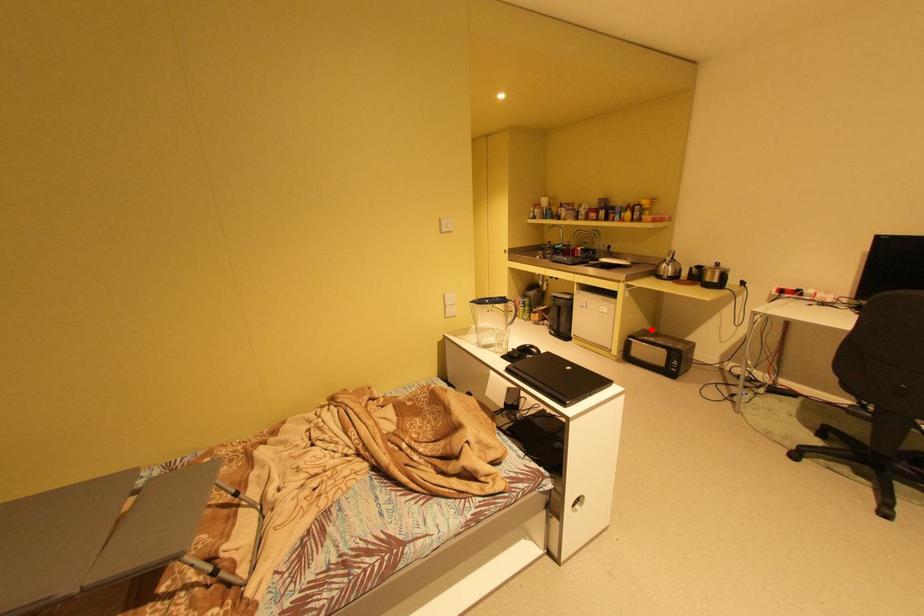
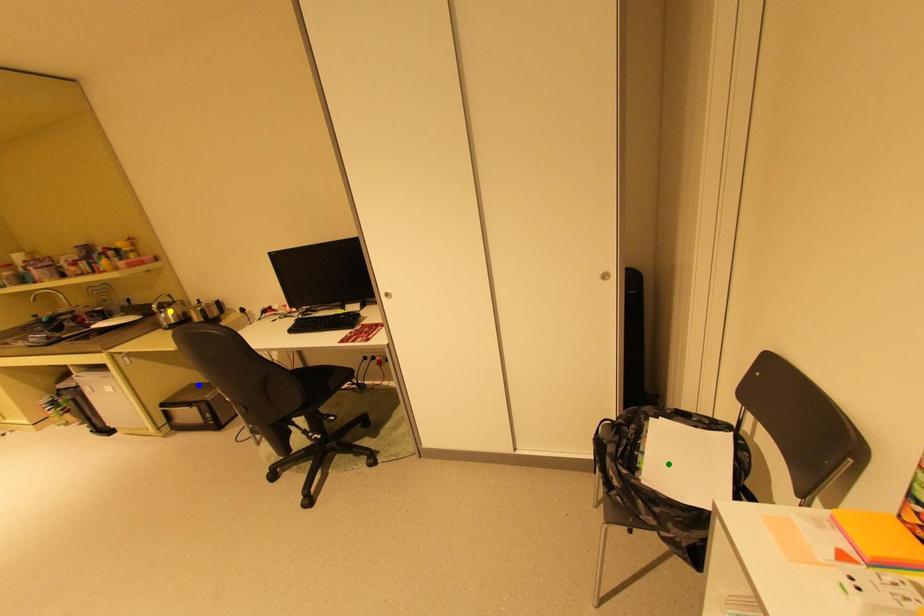
Question: I am providing you with two images of the same scene from different viewpoints. A red point is marked on the first image. You are given multiple points on the second image. Which spot in image 2 lines up with the point in image 1?

Choices:
 (A) green point
 (B) yellow point
 (C) blue point

Answer: (C)